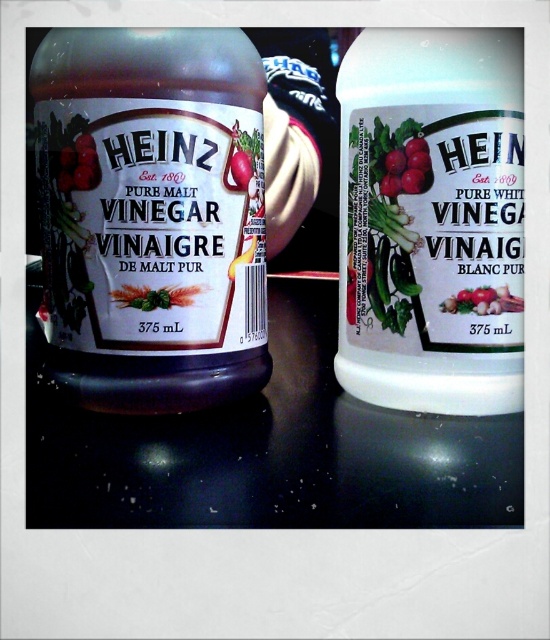
Question: Which point appears closest to the camera in this image?

Choices:
 (A) (388, 148)
 (B) (519, 308)
 (C) (232, 106)

Answer: (C)

Question: Does matte glass bottle at left lie in front of white matte bottle at center?

Choices:
 (A) no
 (B) yes

Answer: (A)

Question: Is white matte bottle at center to the right of red glossy radish at center from the viewer's perspective?

Choices:
 (A) yes
 (B) no

Answer: (B)

Question: Does matte glass bottle at left have a greater width compared to red glossy radish at center?

Choices:
 (A) yes
 (B) no

Answer: (A)

Question: Which of the following is the farthest from the observer?

Choices:
 (A) (156, 51)
 (B) (410, 202)
 (C) (486, 292)

Answer: (B)

Question: Based on their relative distances, which object is farther from the matte glass bottle at left?

Choices:
 (A) white matte bottle at center
 (B) red glossy radish at center

Answer: (B)